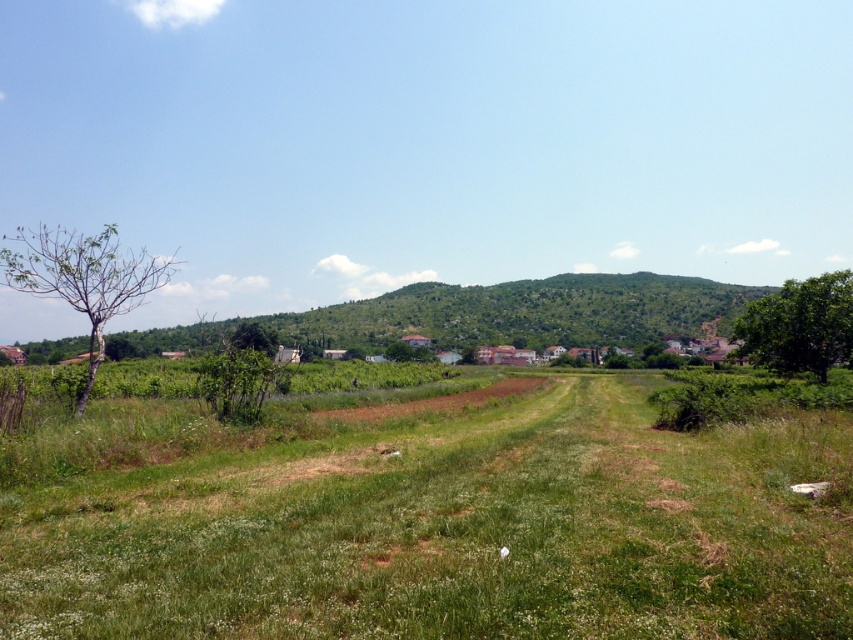
You are a hiker standing on the dirt path in the center of the green grassy field at center. You want to walk towards the bare wood tree at left. Which direction should you head to reach the tree?

The green grassy field at center has a lesser width compared to the bare wood tree at left, so you should head towards the left direction to reach the tree.

You are a hiker standing on the dirt path in the center of the field. You want to take a photo of both the bare wood tree at left and the green leafy tree at right. Which tree should you move closer to in order to include both in your camera frame?

You should move closer to the green leafy tree at right because the bare wood tree at left is already closer to you, so moving towards the farther tree will help balance their sizes in the frame.